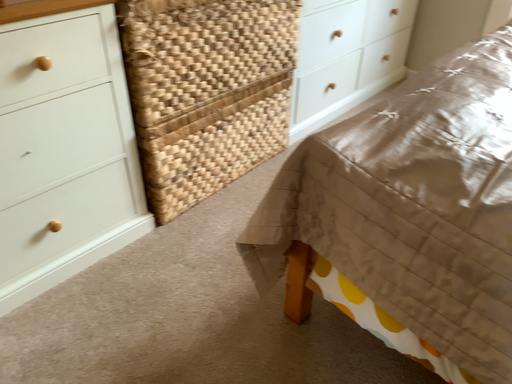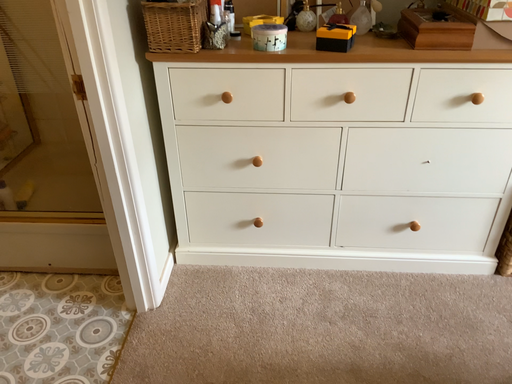
Question: Which way did the camera rotate in the video?

Choices:
 (A) rotated right
 (B) rotated left

Answer: (B)